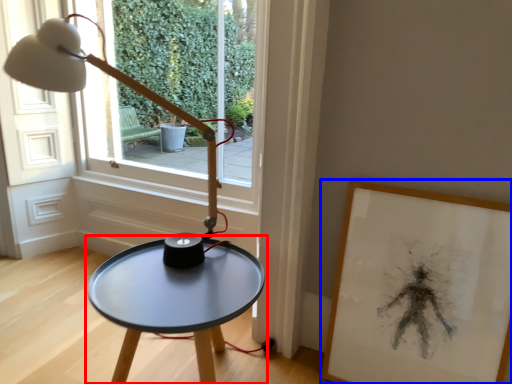
Question: Which object appears farthest to the camera in this image, table (highlighted by a red box) or picture frame (highlighted by a blue box)?

Choices:
 (A) table
 (B) picture frame

Answer: (B)